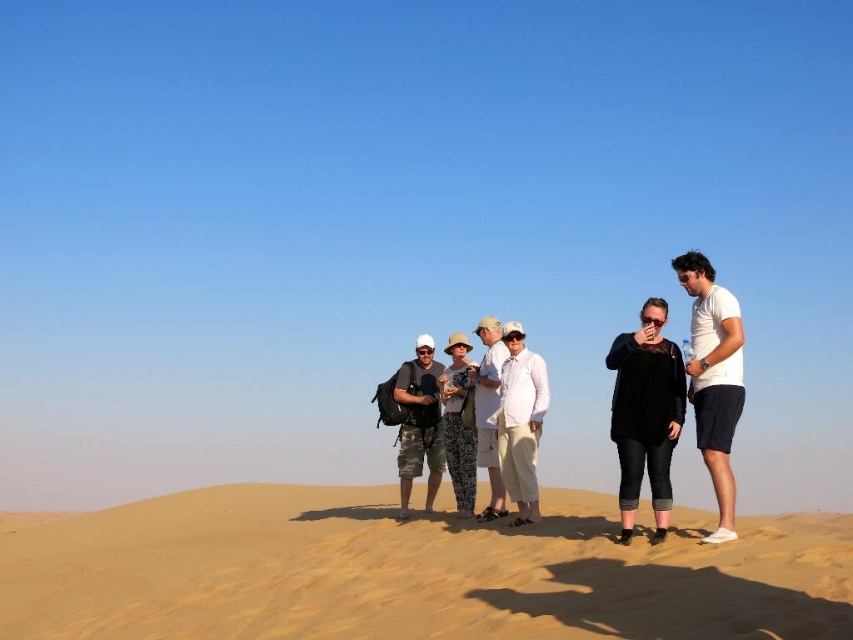
Consider the image. You are a photographer trying to capture a clear shot of the black lace top at center and the camo fabric shorts at center. Which object is positioned in front of the other?

The black lace top at center is closer to the viewer than the camo fabric shorts at center, so it is positioned in front of the camo fabric shorts at center.

In the scene shown: You are standing on a sandy dune in a desert under a clear blue sky. You see the point at coordinates (410, 572). What is located at that point?

The point at coordinates (410, 572) has fine grained sand at center.